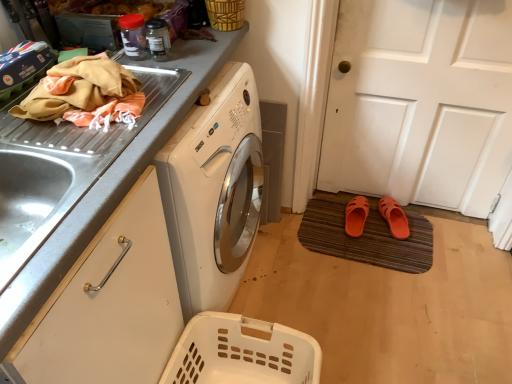
Question: Does woven bamboo basket at upper center, the first basket when ordered from top to bottom, have a larger size compared to brown textured doormat at lower right?

Choices:
 (A) yes
 (B) no

Answer: (B)

Question: From a real-world perspective, does woven bamboo basket at upper center, which ranks as the second basket in bottom-to-top order, stand above brown textured doormat at lower right?

Choices:
 (A) yes
 (B) no

Answer: (A)

Question: From the image's perspective, would you say woven bamboo basket at upper center, the first basket when ordered from top to bottom, is positioned over brown textured doormat at lower right?

Choices:
 (A) no
 (B) yes

Answer: (B)

Question: Considering the relative positions of woven bamboo basket at upper center, the first basket when ordered from top to bottom, and brown textured doormat at lower right in the image provided, is woven bamboo basket at upper center, the first basket when ordered from top to bottom, behind brown textured doormat at lower right?

Choices:
 (A) yes
 (B) no

Answer: (B)

Question: From the image's perspective, is woven bamboo basket at upper center, the first basket when ordered from top to bottom, under brown textured doormat at lower right?

Choices:
 (A) no
 (B) yes

Answer: (A)

Question: Is point (222, 321) closer or farther from the camera than point (349, 231)?

Choices:
 (A) closer
 (B) farther

Answer: (A)

Question: Looking at the image, does white plastic laundry basket at lower center, which is counted as the 1th basket, starting from the bottom, seem bigger or smaller compared to orange rubber slipper at lower center, acting as the 2th footwear starting from the right?

Choices:
 (A) small
 (B) big

Answer: (B)

Question: From a real-world perspective, is white plastic laundry basket at lower center, the 2th basket when ordered from top to bottom, positioned above or below orange rubber slipper at lower center, acting as the 2th footwear starting from the right?

Choices:
 (A) above
 (B) below

Answer: (A)

Question: Is white plastic laundry basket at lower center, the 2th basket when ordered from top to bottom, situated inside orange rubber slipper at lower center, arranged as the first footwear when viewed from the left, or outside?

Choices:
 (A) outside
 (B) inside

Answer: (A)

Question: From their relative heights in the image, would you say white plastic laundry basket at lower center, which is counted as the 1th basket, starting from the bottom, is taller or shorter than metallic gray countertop at upper left?

Choices:
 (A) short
 (B) tall

Answer: (A)

Question: Is point (217, 349) closer or farther from the camera than point (11, 302)?

Choices:
 (A) farther
 (B) closer

Answer: (A)

Question: From the image's perspective, relative to metallic gray countertop at upper left, is white plastic laundry basket at lower center, which is counted as the 1th basket, starting from the bottom, above or below?

Choices:
 (A) above
 (B) below

Answer: (B)

Question: From a real-world perspective, is white plastic laundry basket at lower center, the 2th basket when ordered from top to bottom, physically located above or below metallic gray countertop at upper left?

Choices:
 (A) below
 (B) above

Answer: (A)

Question: Based on their positions, is metallic gray countertop at upper left located to the left or right of brown textured doormat at lower right?

Choices:
 (A) left
 (B) right

Answer: (A)

Question: Looking at the image, does metallic gray countertop at upper left seem bigger or smaller compared to brown textured doormat at lower right?

Choices:
 (A) small
 (B) big

Answer: (B)